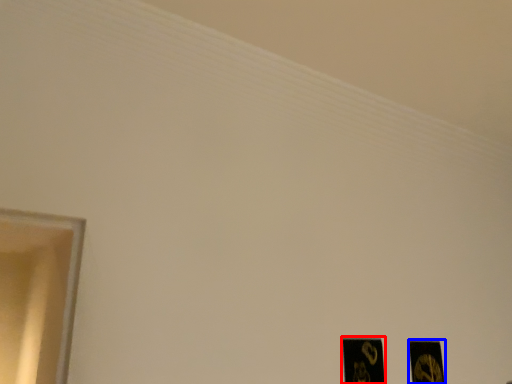
Question: Which object appears closest to the camera in this image, picture frame (highlighted by a red box) or picture frame (highlighted by a blue box)?

Choices:
 (A) picture frame
 (B) picture frame

Answer: (A)